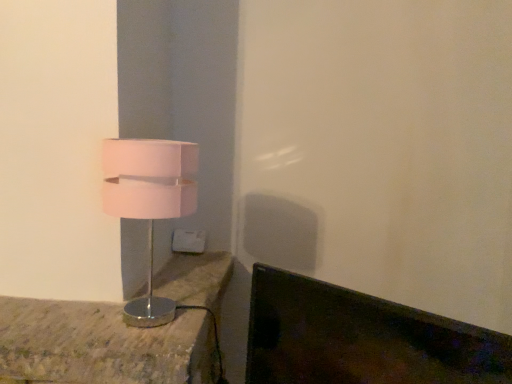
Identify the location of metallic silver lamp at left. The width and height of the screenshot is (512, 384). (101, 345).

Looking at this image, measure the distance between pink matte lampshade at left and camera.

They are 30.11 inches apart.

At what (x,y) coordinates should I click in order to perform the action: click on metallic silver lamp at left. Please return your answer as a coordinate pair (x, y). This screenshot has height=384, width=512. Looking at the image, I should click on (101, 345).

Looking at this image, is pink matte lampshade at left bigger or smaller than metallic silver lamp at left?

Clearly, pink matte lampshade at left is smaller in size than metallic silver lamp at left.

From a real-world perspective, is pink matte lampshade at left located higher than metallic silver lamp at left?

Indeed, from a real-world perspective, pink matte lampshade at left stands above metallic silver lamp at left.

From the image's perspective, who appears lower, pink matte lampshade at left or metallic silver lamp at left?

metallic silver lamp at left, from the image's perspective.

Between pink matte lampshade at left and metallic silver lamp at left, which one is positioned in front?

metallic silver lamp at left is closer to the camera.

Between white plastic electric outlet at center and metallic silver lamp at left, which one has more height?

metallic silver lamp at left is taller.

Is white plastic electric outlet at center with metallic silver lamp at left?

white plastic electric outlet at center and metallic silver lamp at left are not in contact.

Would you say white plastic electric outlet at center is to the left or to the right of metallic silver lamp at left in the picture?

white plastic electric outlet at center is positioned on metallic silver lamp at left's right side.

Is white plastic electric outlet at center aimed at metallic silver lamp at left?

Yes, white plastic electric outlet at center is turned towards metallic silver lamp at left.

Are metallic silver lamp at left and pink matte lampshade at left far apart?

metallic silver lamp at left is actually quite close to pink matte lampshade at left.

Does metallic silver lamp at left have a lesser width compared to pink matte lampshade at left?

No.

Would you say pink matte lampshade at left is part of metallic silver lamp at left's contents?

No, pink matte lampshade at left is not inside metallic silver lamp at left.

Which point is more forward, (158, 284) or (112, 158)?

The point (112, 158) is in front.

Is metallic silver lamp at left wider than white plastic electric outlet at center?

Correct, the width of metallic silver lamp at left exceeds that of white plastic electric outlet at center.

From the image's perspective, is metallic silver lamp at left positioned above or below white plastic electric outlet at center?

Clearly, from the image's perspective, metallic silver lamp at left is below white plastic electric outlet at center.

Is there a large distance between metallic silver lamp at left and white plastic electric outlet at center?

No, metallic silver lamp at left is not far from white plastic electric outlet at center.

Is white plastic electric outlet at center not inside pink matte lampshade at left?

Yes.

Is white plastic electric outlet at center aimed at pink matte lampshade at left?

Yes, white plastic electric outlet at center is oriented towards pink matte lampshade at left.

Can you confirm if white plastic electric outlet at center is positioned to the left of pink matte lampshade at left?

Incorrect, white plastic electric outlet at center is not on the left side of pink matte lampshade at left.

Is point (180, 237) positioned in front of point (165, 309)?

No.

Is white plastic electric outlet at center at the back of pink matte lampshade at left?

Yes.

What are the coordinates of `lamp that is in front of the white plastic electric outlet at center` in the screenshot? It's located at (149, 202).

Considering the relative sizes of pink matte lampshade at left and white plastic electric outlet at center in the image provided, is pink matte lampshade at left wider than white plastic electric outlet at center?

Yes.

Between pink matte lampshade at left and white plastic electric outlet at center, which one has larger size?

Bigger between the two is pink matte lampshade at left.

The image size is (512, 384). In order to click on furniture on the left of pink matte lampshade at left in this screenshot , I will do `click(101, 345)`.

You are a GUI agent. You are given a task and a screenshot of the screen. Output one action in this format:
    pyautogui.click(x=<x>, y=<y>)
    Task: Click on the furniture in front of the white plastic electric outlet at center
    This screenshot has width=512, height=384.
    Given the screenshot: What is the action you would take?
    pyautogui.click(x=101, y=345)

When comparing their distances from white plastic electric outlet at center, does pink matte lampshade at left or metallic silver lamp at left seem closer?

metallic silver lamp at left.

From the image, which object appears to be nearer to metallic silver lamp at left, white plastic electric outlet at center or pink matte lampshade at left?

pink matte lampshade at left.

Based on their spatial positions, is metallic silver lamp at left or pink matte lampshade at left further from white plastic electric outlet at center?

pink matte lampshade at left lies further to white plastic electric outlet at center than the other object.

From the image, which object appears to be nearer to pink matte lampshade at left, metallic silver lamp at left or white plastic electric outlet at center?

metallic silver lamp at left.

Based on their spatial positions, is white plastic electric outlet at center or metallic silver lamp at left further from pink matte lampshade at left?

Based on the image, white plastic electric outlet at center appears to be further to pink matte lampshade at left.

Looking at the image, which one is located further to metallic silver lamp at left, pink matte lampshade at left or white plastic electric outlet at center?

The object further to metallic silver lamp at left is white plastic electric outlet at center.

Locate an element on the screen. lamp between metallic silver lamp at left and white plastic electric outlet at center along the z-axis is located at coordinates (149, 202).